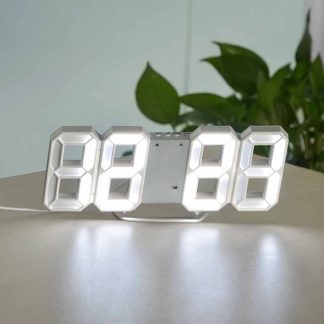
Locate an element on the screen. Image resolution: width=324 pixels, height=324 pixels. wall is located at coordinates (41, 26), (249, 18).